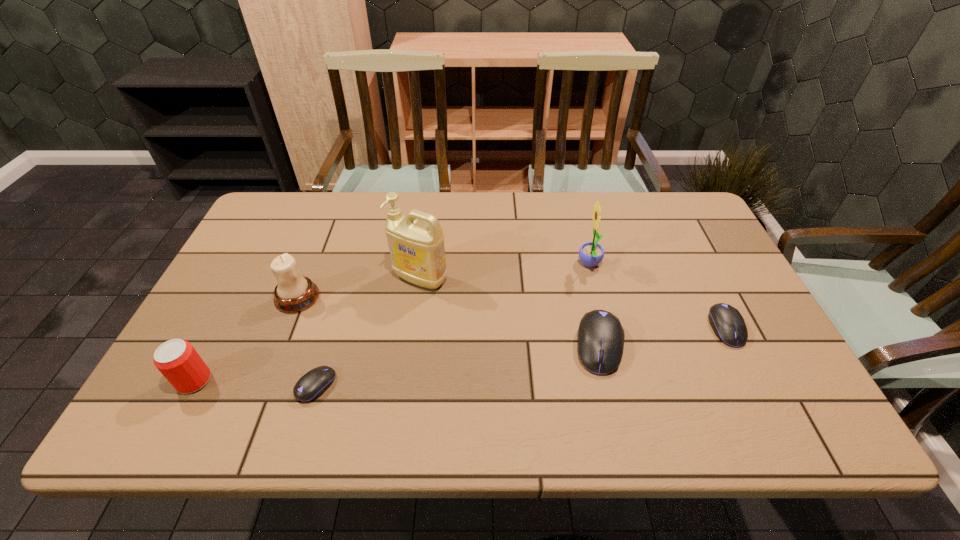
This screenshot has width=960, height=540. What are the coordinates of `the third object from left to right` in the screenshot? It's located at (314, 383).

What are the coordinates of `the shortest computer mouse` in the screenshot? It's located at (314, 383).

This screenshot has width=960, height=540. I want to click on the tallest computer mouse, so click(x=601, y=336).

Identify the location of the fifth tallest object. (x=601, y=336).

Where is `the second tallest computer mouse`? The width and height of the screenshot is (960, 540). the second tallest computer mouse is located at coordinates (729, 326).

Find the location of a particular element. Image resolution: width=960 pixels, height=540 pixels. the rightmost computer mouse is located at coordinates (729, 326).

Identify the location of sunflower. 591,254.

Image resolution: width=960 pixels, height=540 pixels. Find the location of `the fifth shortest object`. the fifth shortest object is located at coordinates (294, 292).

At what (x,y) coordinates should I click in order to perform the action: click on candle holder. Please return your answer as a coordinate pair (x, y). Looking at the image, I should click on (294, 292).

Find the location of a particular element. This screenshot has height=540, width=960. the tallest object is located at coordinates (416, 241).